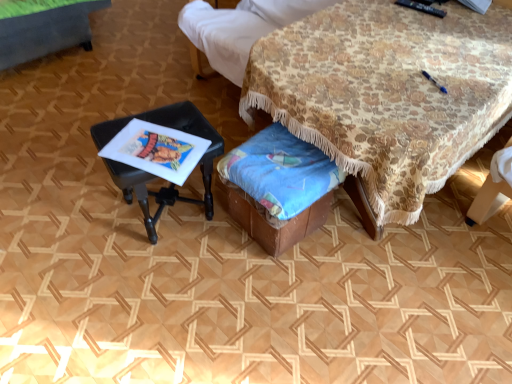
Identify the location of vacant region above blue fabric at lower center (from a real-world perspective). (283, 159).